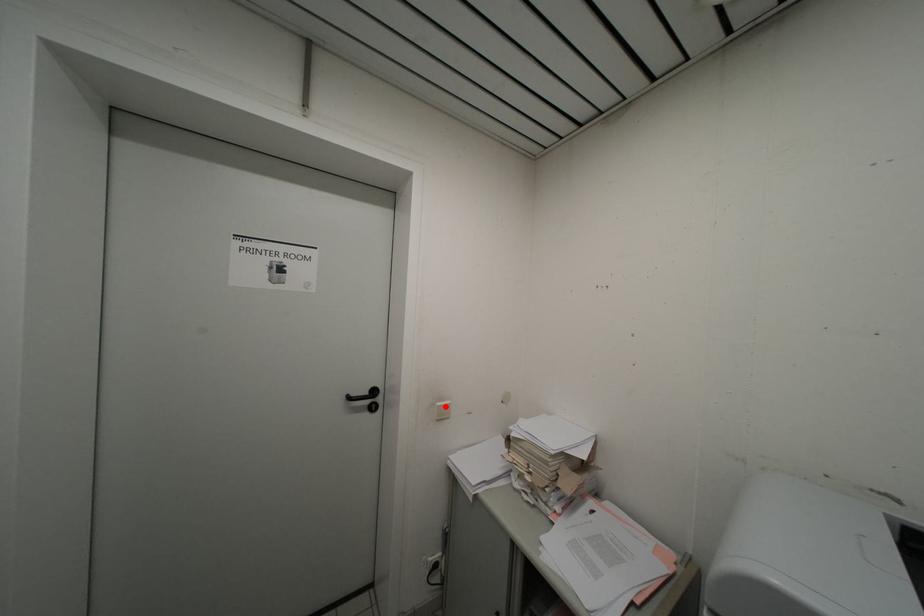
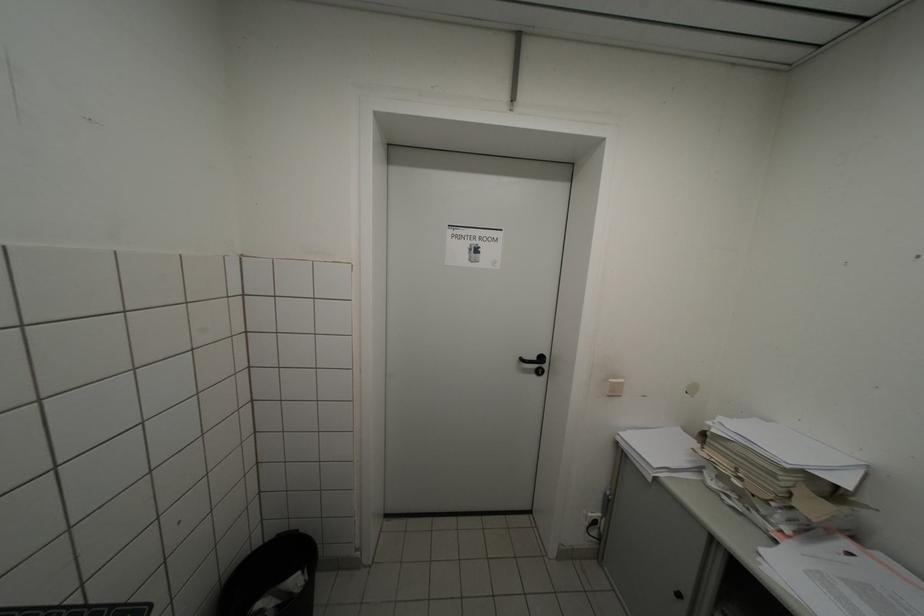
In the second image, find the point that corresponds to the highlighted location in the first image.

(618, 383)